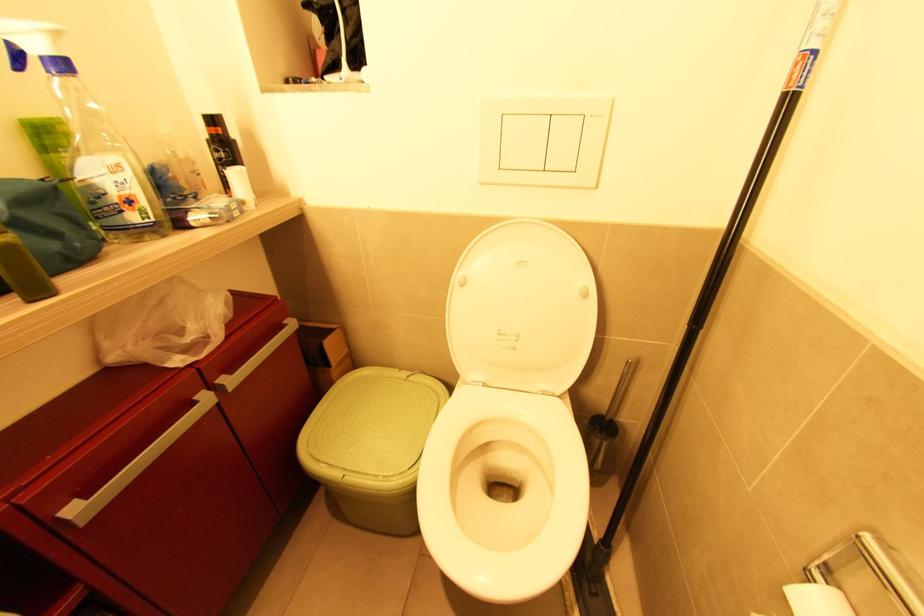
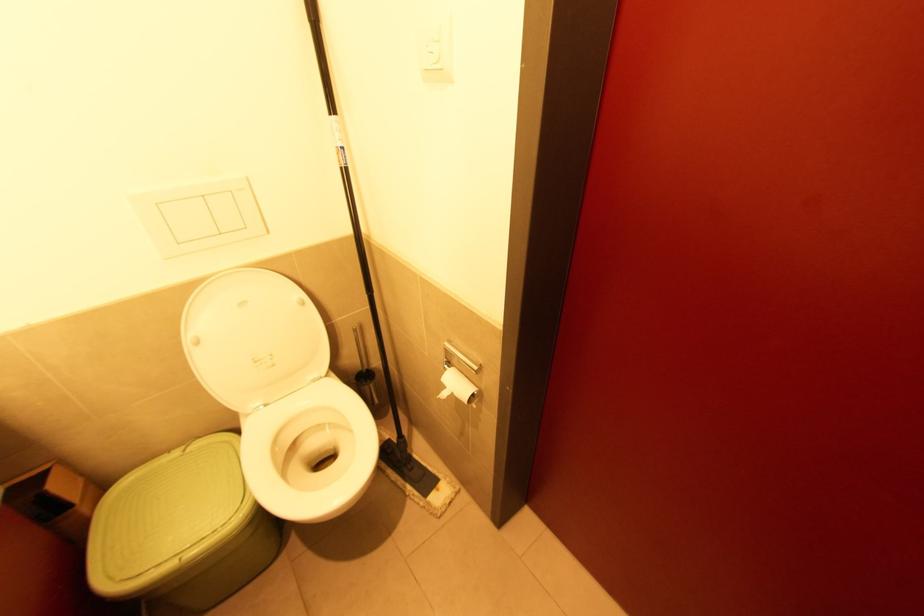
In the second image, find the point that corresponds to (465,285) in the first image.

(200, 342)